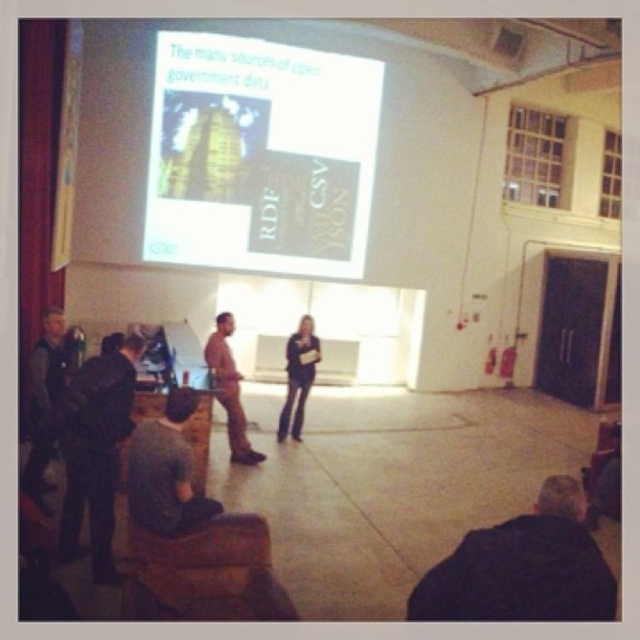
You are a GUI agent. You are given a task and a screenshot of the screen. Output one action in this format:
    pyautogui.click(x=<x>, y=<y>)
    Task: Click on the dark gray pants at lower left
    This screenshot has height=640, width=640.
    Given the screenshot: What is the action you would take?
    pyautogui.click(x=96, y=451)

Is dark gray pants at lower left positioned behind dark gray jacket at left?

That is False.

Describe the element at coordinates (96, 451) in the screenshot. I see `dark gray pants at lower left` at that location.

You are a GUI agent. You are given a task and a screenshot of the screen. Output one action in this format:
    pyautogui.click(x=<x>, y=<y>)
    Task: Click on the dark gray pants at lower left
    The width and height of the screenshot is (640, 640).
    Given the screenshot: What is the action you would take?
    pyautogui.click(x=96, y=451)

Is gray fabric shirt at lower left taller than brown leather jacket at center?

No.

Is point (216, 506) positioned in front of point (228, 333)?

Yes, point (216, 506) is in front of point (228, 333).

Image resolution: width=640 pixels, height=640 pixels. What do you see at coordinates (164, 470) in the screenshot?
I see `gray fabric shirt at lower left` at bounding box center [164, 470].

Identify the location of gray fabric shirt at lower left. point(164,470).

Is point (104, 436) positioned in front of point (184, 420)?

No.

Does dark gray pants at lower left appear over gray fabric shirt at lower left?

Incorrect, dark gray pants at lower left is not positioned above gray fabric shirt at lower left.

Is point (102, 520) closer to viewer compared to point (179, 476)?

No.

Locate an element on the screen. The image size is (640, 640). dark gray pants at lower left is located at coordinates (96, 451).